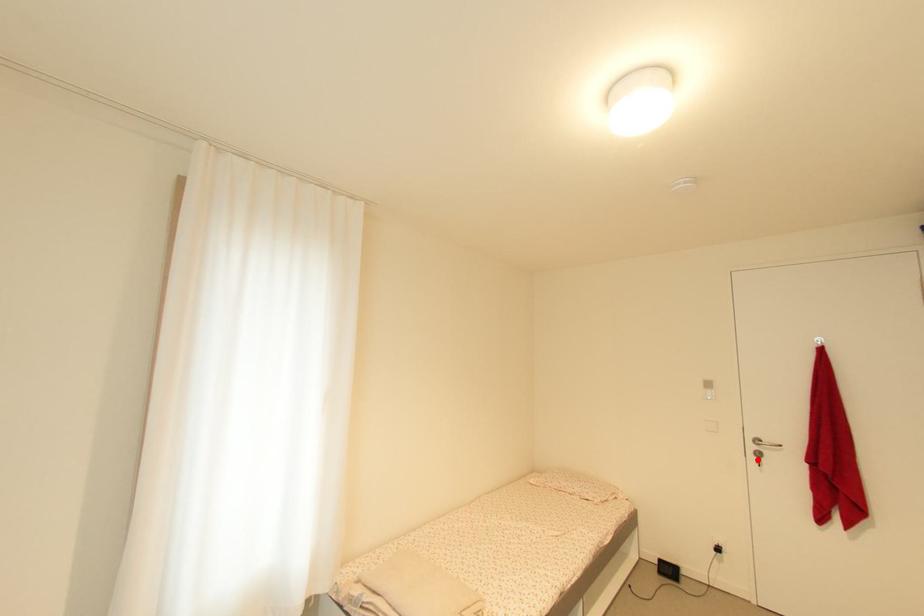
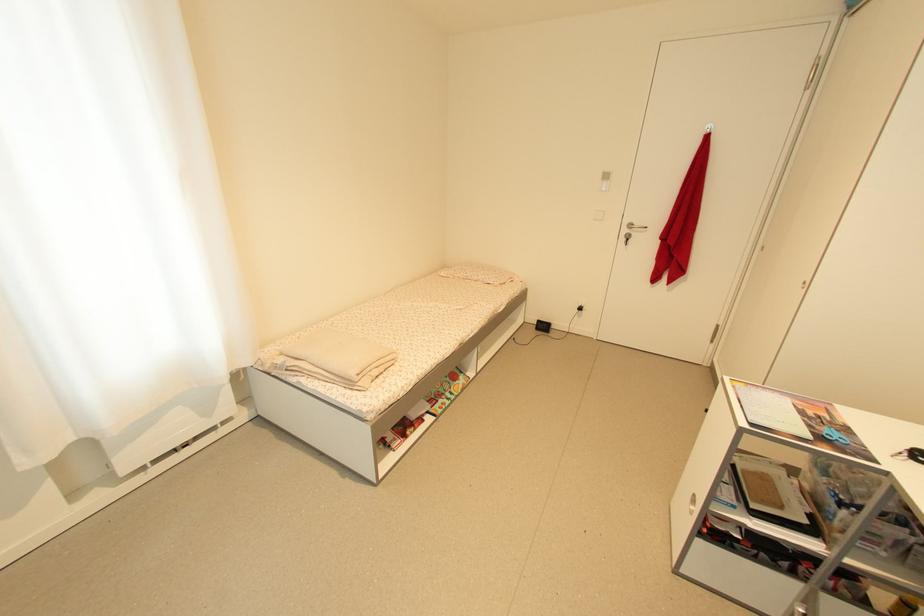
Find the pixel in the second image that matches the highlighted location in the first image.

(627, 241)